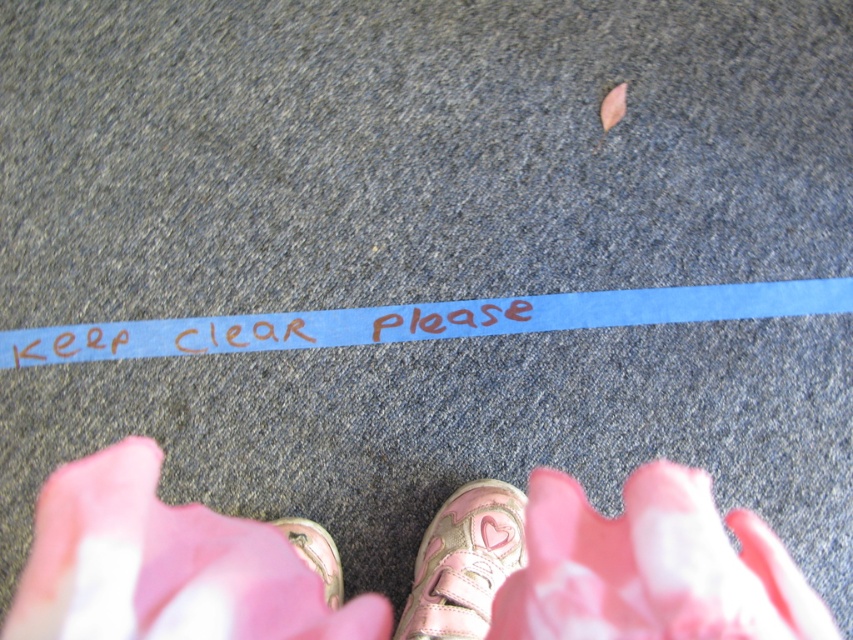
Can you confirm if blue paper strip at center is smaller than pink glittery sneaker at lower center?

Indeed, blue paper strip at center has a smaller size compared to pink glittery sneaker at lower center.

At what (x,y) coordinates should I click in order to perform the action: click on blue paper strip at center. Please return your answer as a coordinate pair (x, y). This screenshot has height=640, width=853. Looking at the image, I should click on (421, 321).

Between point (653, 289) and point (463, 513), which one is positioned behind?

Point (653, 289)

This screenshot has height=640, width=853. In order to click on blue paper strip at center in this screenshot , I will do `click(421, 321)`.

Can you confirm if blue paper strip at center is shorter than metallic pink shoe at lower center?

Yes, blue paper strip at center is shorter than metallic pink shoe at lower center.

Does point (721, 312) come closer to viewer compared to point (312, 564)?

No, it is not.

What are the coordinates of `blue paper strip at center` in the screenshot? It's located at (421, 321).

Who is higher up, pink glittery sneaker at lower center or metallic pink shoe at lower center?

metallic pink shoe at lower center

Which of these two, pink glittery sneaker at lower center or metallic pink shoe at lower center, stands shorter?

metallic pink shoe at lower center

Who is more distant from viewer, (440,544) or (288,525)?

Positioned behind is point (288,525).

The width and height of the screenshot is (853, 640). I want to click on pink glittery sneaker at lower center, so click(x=463, y=561).